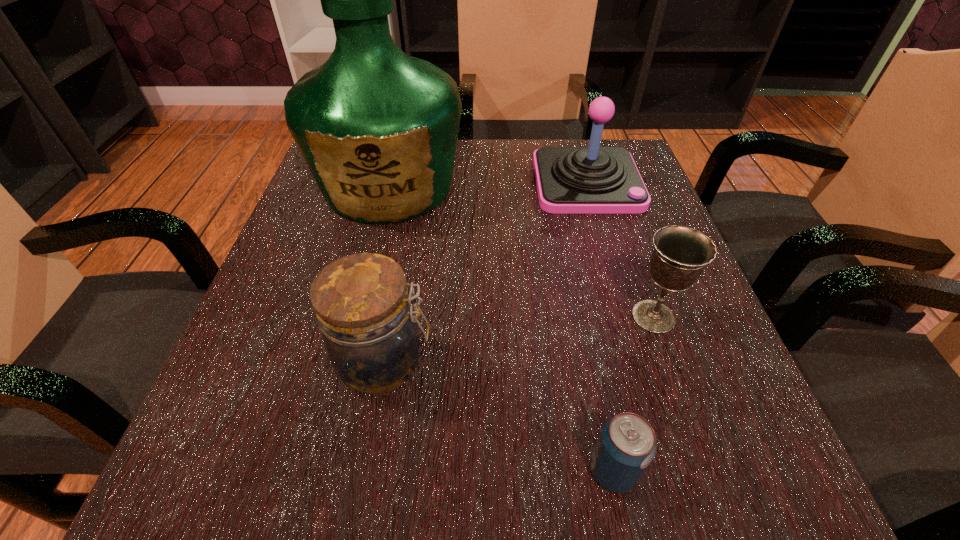
Find the location of a particular element. the tallest object is located at coordinates (378, 129).

At what (x,y) coordinates should I click in order to perform the action: click on joystick. Please return your answer as a coordinate pair (x, y). This screenshot has height=540, width=960. Looking at the image, I should click on (570, 180).

Locate an element on the screen. The height and width of the screenshot is (540, 960). jar is located at coordinates (362, 304).

At what (x,y) coordinates should I click in order to perform the action: click on chalice. Please return your answer as a coordinate pair (x, y). The image size is (960, 540). Looking at the image, I should click on (680, 253).

Locate an element on the screen. pop soda is located at coordinates (627, 444).

Identify the location of the shortest object. The height and width of the screenshot is (540, 960). (627, 444).

What are the coordinates of `vacant region located on the label side of the liquor` in the screenshot? It's located at (353, 328).

Locate an element on the screen. Image resolution: width=960 pixels, height=540 pixels. free region located 0.370m forward from the base of the joystick is located at coordinates (641, 367).

Where is `free space located on the lid of the jar`? free space located on the lid of the jar is located at coordinates (524, 362).

I want to click on free space located 0.090m on the front of the chalice, so click(679, 388).